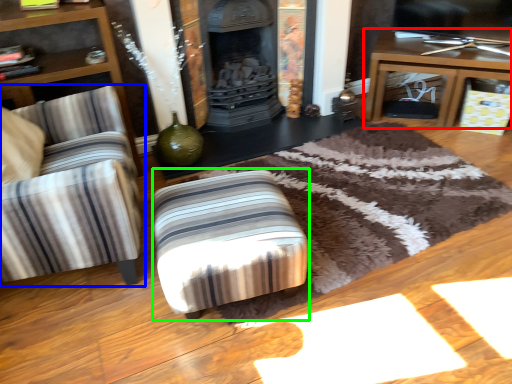
Question: Considering the real-world distances, which object is farthest from table (highlighted by a red box)? chair (highlighted by a blue box) or stool (highlighted by a green box)?

Choices:
 (A) chair
 (B) stool

Answer: (A)